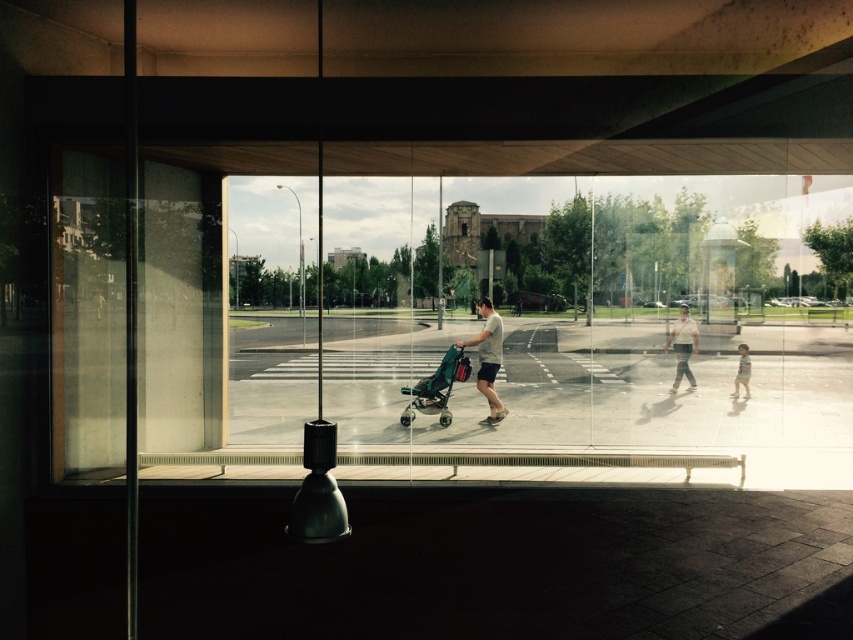
Question: Among these points, which one is farthest from the camera?

Choices:
 (A) (490, 376)
 (B) (804, 390)
 (C) (486, 422)
 (D) (445, 362)

Answer: (B)

Question: Is transparent glass window at center bigger than matte black skateboard at center?

Choices:
 (A) no
 (B) yes

Answer: (B)

Question: Which is farther from the transparent glass window at center?

Choices:
 (A) matte black skateboard at center
 (B) wooden skateboard at lower right
 (C) light blue cotton shirt at lower right

Answer: (A)

Question: Can you confirm if transparent glass window at center is wider than matte gray t-shirt at center?

Choices:
 (A) no
 (B) yes

Answer: (B)

Question: Considering the relative positions of transparent glass window at center and matte black skateboard at center in the image provided, where is transparent glass window at center located with respect to matte black skateboard at center?

Choices:
 (A) right
 (B) left

Answer: (B)

Question: Which of the following is the farthest from the observer?

Choices:
 (A) (492, 417)
 (B) (485, 422)
 (C) (390, 388)

Answer: (C)